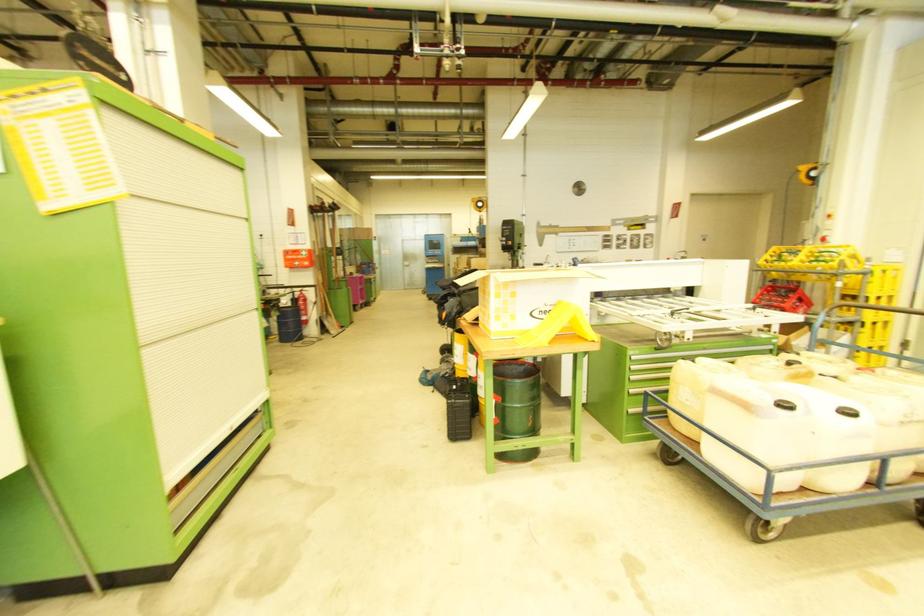
Where would you lift the long tool handle? Please return your answer as a coordinate pair (x, y).

(653, 381)